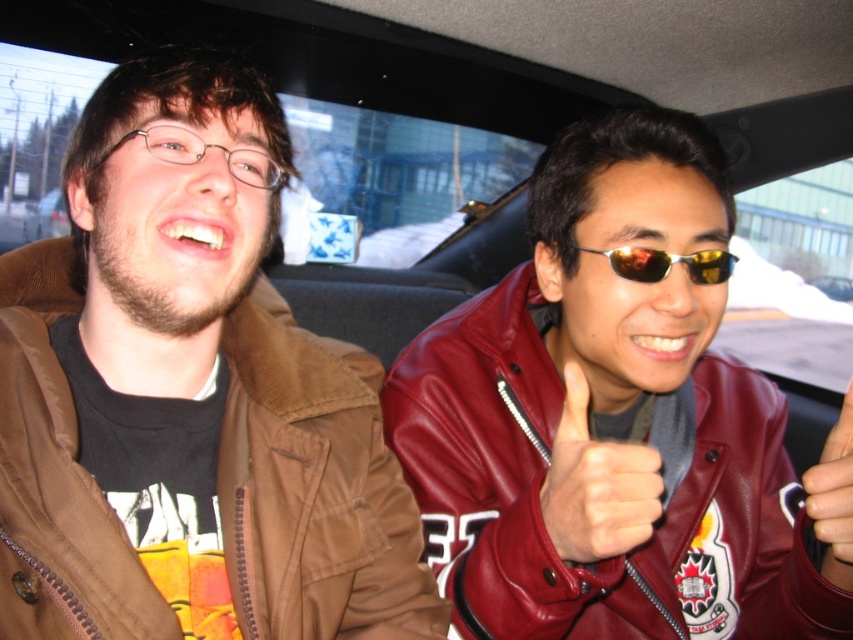
Question: Which is farther from the shiny maroon leather jacket at right?

Choices:
 (A) metallic silver ring at upper right
 (B) leather at center
 (C) gold reflective sunglasses at center

Answer: (C)

Question: Which point is farther to the camera?

Choices:
 (A) leather at center
 (B) metallic silver ring at upper right

Answer: (B)

Question: Is shiny maroon leather jacket at right above gold reflective sunglasses at center?

Choices:
 (A) yes
 (B) no

Answer: (B)

Question: Does shiny maroon leather jacket at right have a larger size compared to metallic silver ring at upper right?

Choices:
 (A) yes
 (B) no

Answer: (A)

Question: Which of the following is the closest to the observer?

Choices:
 (A) gold reflective sunglasses at center
 (B) leather at center

Answer: (B)

Question: Is leather at center to the left of metallic silver ring at upper right from the viewer's perspective?

Choices:
 (A) yes
 (B) no

Answer: (A)